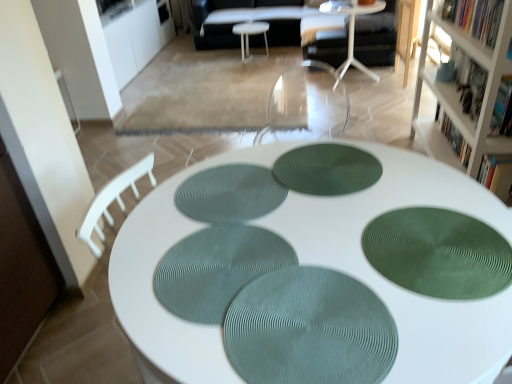
The height and width of the screenshot is (384, 512). In order to click on free space above white textured table at center, the third table positioned from the back (from a real-world perspective) in this screenshot , I will do `click(291, 263)`.